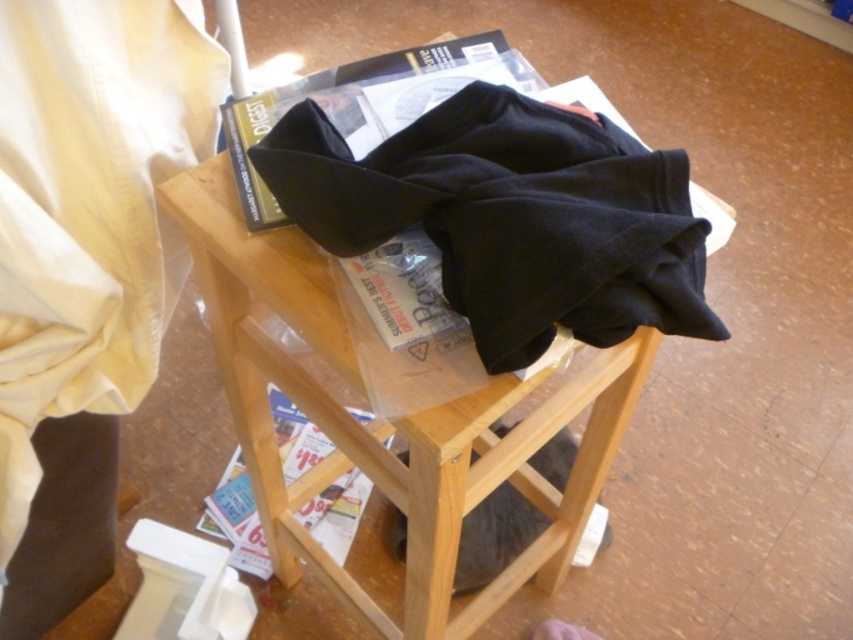
You are a delivery person who needs to place a package on the stool. The package is 22 inches long. Can you safely place it on the black cotton blanket at center without it hanging over the edge?

The black cotton blanket at center is positioned 20.88 inches away from the camera. Since the package is 22 inches long, it may extend beyond the edge of the stool when placed on the blanket, so it might not be safe to place it there without it hanging over the edge.

From the picture: You are organizing a closet and need to place the matte black magazine at center onto the wooden stool at center. Considering their sizes, will the magazine fit on the stool without hanging off the edges?

The wooden stool at center is bigger than matte black magazine at center, so the magazine will fit on the wooden stool at center without hanging off the edges.